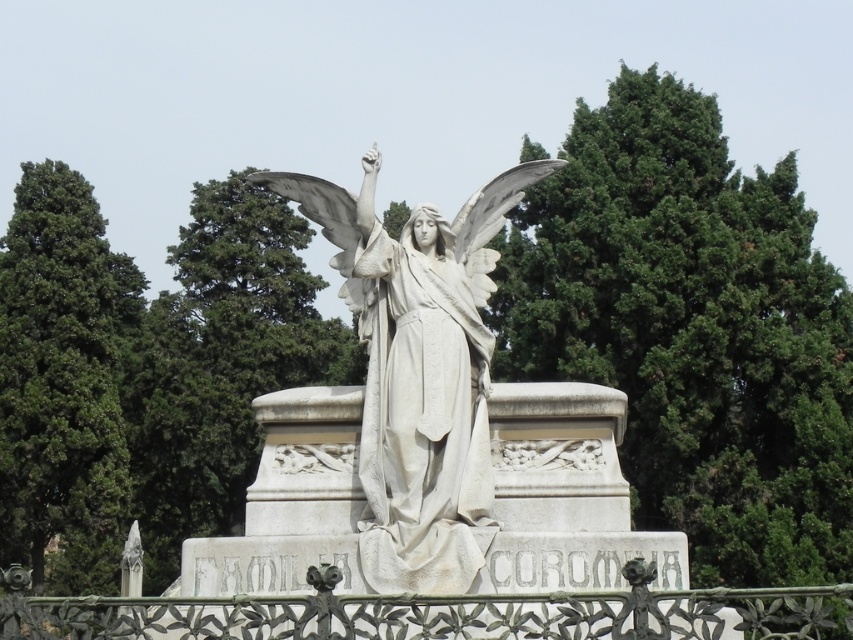
You are standing in front of the statue and want to take a photo of the wrought iron fence at lower center without including the green leafy tree at left. Which direction should you move to achieve this?

You should move to the right side of the wrought iron fence at lower center to avoid including the green leafy tree at left in your photo.

In the scene shown: You are standing in front of the statue and want to take a photo that includes both the statue and the green leafy tree at upper center. Where should you position yourself relative to the statue to ensure both are in frame?

To include both the statue and the green leafy tree at upper center in your photo, position yourself directly in front of the statue, as the tree is located at the upper center point of the scene, which is likely above and centered relative to the statue.

You are standing in front of the statue and want to take a photo. You notice two points on the statue. One is at point [758,381] and the other is at point [381,324]. Which point is closer to your camera lens?

Point [381,324] is closer to the camera lens because it is less further away than point [758,381].